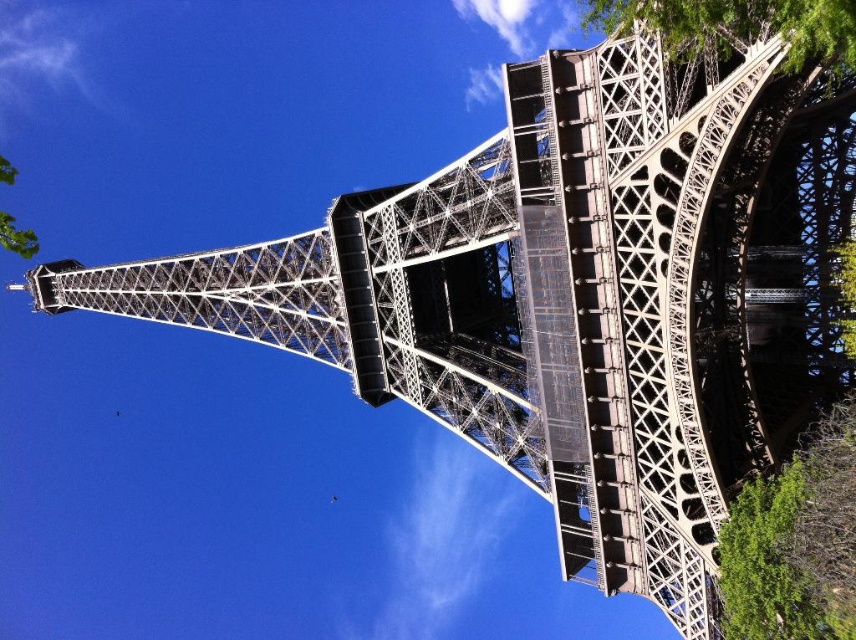
Based on the photo, you are standing at the base of the Eiffel Tower and want to take a photo of the green leafy tree at upper right. If your camera can focus on objects up to 50 meters away, will you be able to capture the tree clearly?

The green leafy tree at upper right and camera are 42.36 meters apart. Since the camera can focus up to 50 meters, the distance is within range, so yes, you can capture the tree clearly.

You are a drone operator planning to fly a drone from the base of the Eiffel Tower to a specific point in the sky. The Eiffel Tower is in the center of your view. You need to avoid the green leafy tree at upper right. According to the coordinates provided, where should you direct your drone to fly to avoid the tree?

The green leafy tree at upper right is located at coordinates point (739, 28). To avoid it, direct the drone to fly to a different point away from those coordinates, such as lower left or center areas.